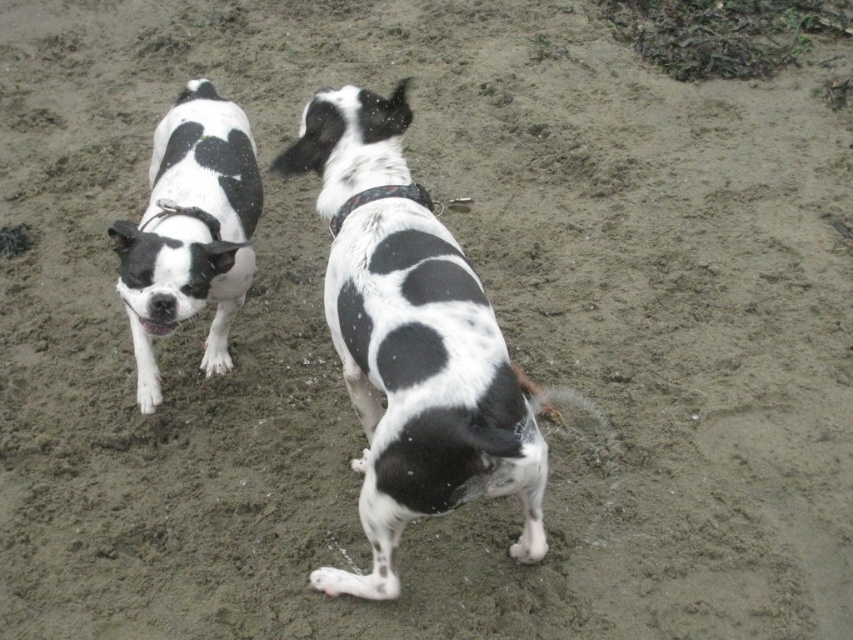
Question: Among these objects, which one is nearest to the camera?

Choices:
 (A) black and white fur dog at center
 (B) black and white fur dog at left
 (C) black fabric collar at center

Answer: (A)

Question: Does black and white fur dog at left appear on the right side of black fabric collar at center?

Choices:
 (A) yes
 (B) no

Answer: (B)

Question: Estimate the real-world distances between objects in this image. Which object is closer to the black fabric collar at center?

Choices:
 (A) black and white fur dog at center
 (B) black and white fur dog at left

Answer: (A)

Question: Which point appears closest to the camera in this image?

Choices:
 (A) (380, 196)
 (B) (334, 339)

Answer: (A)

Question: Can you confirm if black and white fur dog at center is thinner than black fabric collar at center?

Choices:
 (A) yes
 (B) no

Answer: (B)

Question: Is black and white fur dog at center further to camera compared to black and white fur dog at left?

Choices:
 (A) yes
 (B) no

Answer: (B)